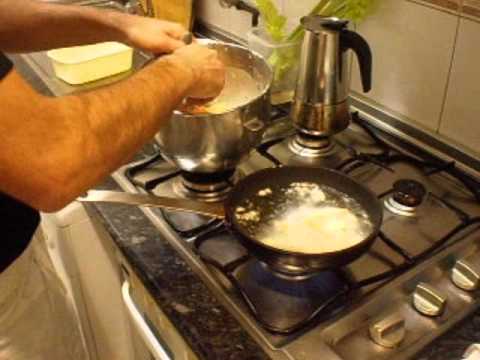
Where is `knob`? knob is located at coordinates [x=385, y=320].